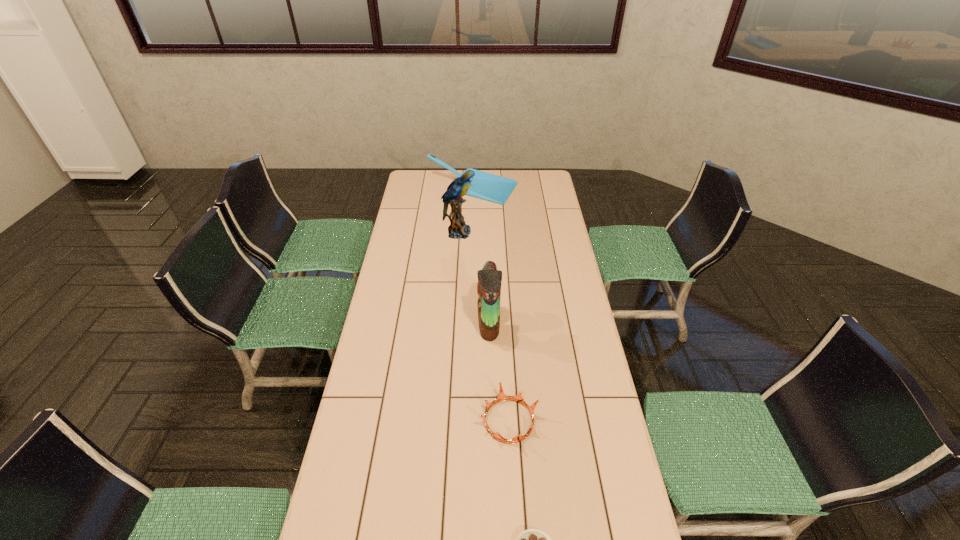
You are a GUI agent. You are given a task and a screenshot of the screen. Output one action in this format:
    pyautogui.click(x=<x>, y=<y>)
    Task: Click on the farther parrot
    This screenshot has width=960, height=540.
    Given the screenshot: What is the action you would take?
    pyautogui.click(x=458, y=229)

You are a GUI agent. You are given a task and a screenshot of the screen. Output one action in this format:
    pyautogui.click(x=<x>, y=<y>)
    Task: Click on the second farthest object
    The width and height of the screenshot is (960, 540).
    Given the screenshot: What is the action you would take?
    pyautogui.click(x=458, y=229)

Locate an element on the screen. This screenshot has height=540, width=960. the nearer parrot is located at coordinates (489, 278).

Identify the location of the fourth shortest object. (489, 278).

At what (x,y) coordinates should I click in order to perform the action: click on dustpan. Please return your answer as a coordinate pair (x, y). This screenshot has width=960, height=540. Looking at the image, I should click on (484, 185).

Find the location of a particular element. The height and width of the screenshot is (540, 960). the third tallest object is located at coordinates (484, 185).

Where is `the second shortest object`? This screenshot has height=540, width=960. the second shortest object is located at coordinates (501, 397).

The height and width of the screenshot is (540, 960). Identify the location of the fourth farthest object. (501, 397).

Identify the location of free space located on the face of the left parrot. (501, 233).

The width and height of the screenshot is (960, 540). In order to click on blank space located at the face of the third farthest object in this screenshot , I will do `click(453, 323)`.